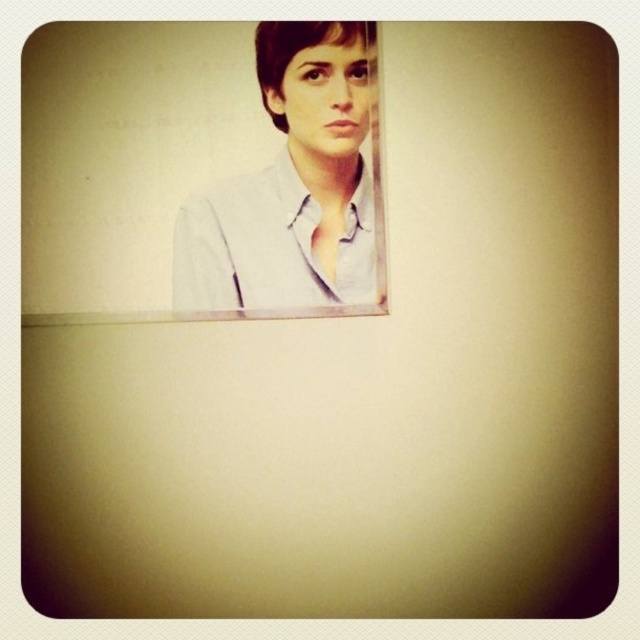
Is light blue shirt at upper center bigger than matte gray shirt at upper center?

Yes, light blue shirt at upper center is bigger than matte gray shirt at upper center.

Does light blue shirt at upper center appear on the right side of matte gray shirt at upper center?

No, light blue shirt at upper center is not to the right of matte gray shirt at upper center.

Where is `light blue shirt at upper center`? light blue shirt at upper center is located at coordinates (292, 184).